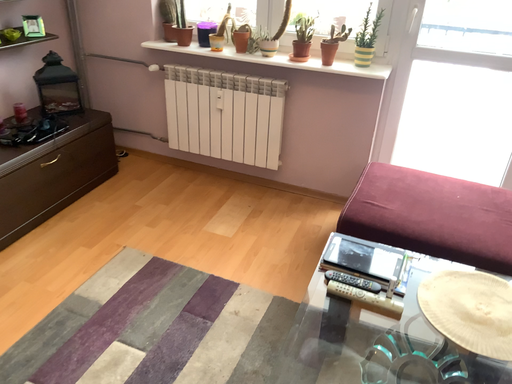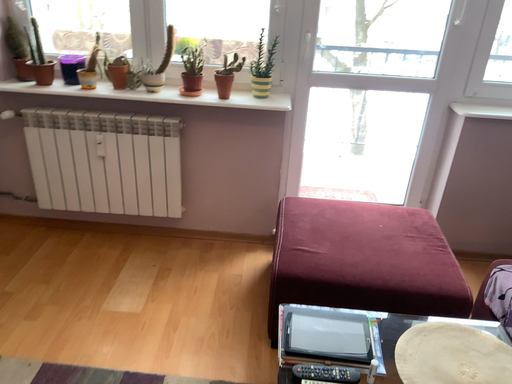
Question: How did the camera likely rotate when shooting the video?

Choices:
 (A) rotated left
 (B) rotated right

Answer: (B)